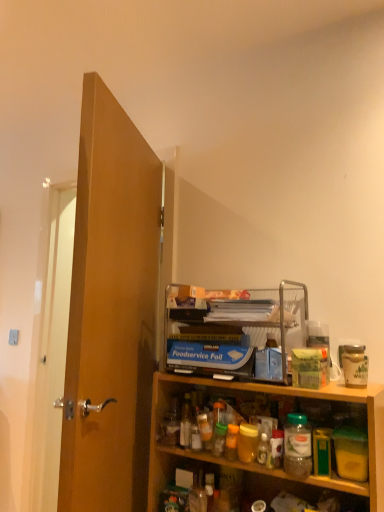
Question: Is the position of wooden door at left less distant than that of blue cardboard foodservice foil at upper center?

Choices:
 (A) no
 (B) yes

Answer: (B)

Question: Is wooden door at left oriented away from blue cardboard foodservice foil at upper center?

Choices:
 (A) no
 (B) yes

Answer: (B)

Question: Does wooden door at left lie behind blue cardboard foodservice foil at upper center?

Choices:
 (A) no
 (B) yes

Answer: (A)

Question: Considering the relative sizes of wooden door at left and blue cardboard foodservice foil at upper center in the image provided, is wooden door at left taller than blue cardboard foodservice foil at upper center?

Choices:
 (A) no
 (B) yes

Answer: (B)

Question: Does wooden door at left have a smaller size compared to blue cardboard foodservice foil at upper center?

Choices:
 (A) no
 (B) yes

Answer: (A)

Question: Is wooden cabinet at lower right taller or shorter than wooden door at left?

Choices:
 (A) tall
 (B) short

Answer: (B)

Question: In the image, is wooden cabinet at lower right positioned in front of or behind wooden door at left?

Choices:
 (A) behind
 (B) front

Answer: (B)

Question: From the image's perspective, relative to wooden door at left, is wooden cabinet at lower right above or below?

Choices:
 (A) above
 (B) below

Answer: (B)

Question: Looking at the image, does wooden cabinet at lower right seem bigger or smaller compared to wooden door at left?

Choices:
 (A) big
 (B) small

Answer: (A)

Question: Is wooden door at left inside the boundaries of wooden cabinet at lower right, or outside?

Choices:
 (A) inside
 (B) outside

Answer: (B)

Question: Is wooden door at left bigger or smaller than wooden cabinet at lower right?

Choices:
 (A) small
 (B) big

Answer: (A)

Question: In terms of width, does wooden door at left look wider or thinner when compared to wooden cabinet at lower right?

Choices:
 (A) wide
 (B) thin

Answer: (B)

Question: Visually, is wooden door at left positioned to the left or to the right of wooden cabinet at lower right?

Choices:
 (A) right
 (B) left

Answer: (B)

Question: Would you say wooden cabinet at lower right is inside or outside blue cardboard foodservice foil at upper center?

Choices:
 (A) outside
 (B) inside

Answer: (A)

Question: In the image, is wooden cabinet at lower right on the left side or the right side of blue cardboard foodservice foil at upper center?

Choices:
 (A) right
 (B) left

Answer: (A)